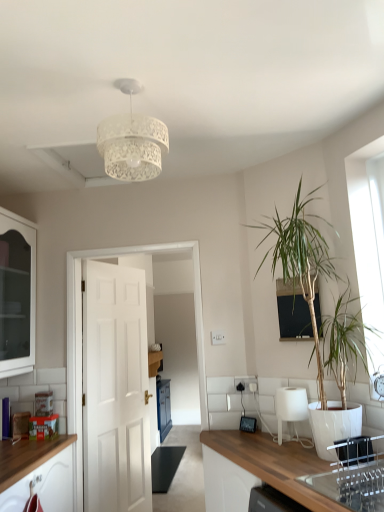
Question: Does clear glass sink at lower right appear on the left side of white glossy lampshade at lower center?

Choices:
 (A) yes
 (B) no

Answer: (B)

Question: From the image's perspective, is clear glass sink at lower right on top of white glossy lampshade at lower center?

Choices:
 (A) yes
 (B) no

Answer: (A)

Question: Can you confirm if clear glass sink at lower right is thinner than white glossy lampshade at lower center?

Choices:
 (A) no
 (B) yes

Answer: (A)

Question: Could white glossy lampshade at lower center be considered to be inside clear glass sink at lower right?

Choices:
 (A) yes
 (B) no

Answer: (B)

Question: Can you confirm if clear glass sink at lower right is bigger than white glossy lampshade at lower center?

Choices:
 (A) no
 (B) yes

Answer: (B)

Question: Is clear glass sink at lower right wider than white glossy lampshade at lower center?

Choices:
 (A) yes
 (B) no

Answer: (A)

Question: Can you confirm if black glass window screen at upper center is thinner than white glass cabinet at left?

Choices:
 (A) yes
 (B) no

Answer: (A)

Question: Considering the relative sizes of black glass window screen at upper center and white glass cabinet at left in the image provided, is black glass window screen at upper center bigger than white glass cabinet at left?

Choices:
 (A) no
 (B) yes

Answer: (A)

Question: Would you say black glass window screen at upper center is a long distance from white glass cabinet at left?

Choices:
 (A) yes
 (B) no

Answer: (A)

Question: From the image's perspective, would you say black glass window screen at upper center is positioned over white glass cabinet at left?

Choices:
 (A) yes
 (B) no

Answer: (B)

Question: Is black glass window screen at upper center aimed at white glass cabinet at left?

Choices:
 (A) yes
 (B) no

Answer: (B)

Question: Can you confirm if black glass window screen at upper center is shorter than white glass cabinet at left?

Choices:
 (A) yes
 (B) no

Answer: (A)

Question: Is the surface of black glass window screen at upper center in direct contact with white matte door at center?

Choices:
 (A) yes
 (B) no

Answer: (B)